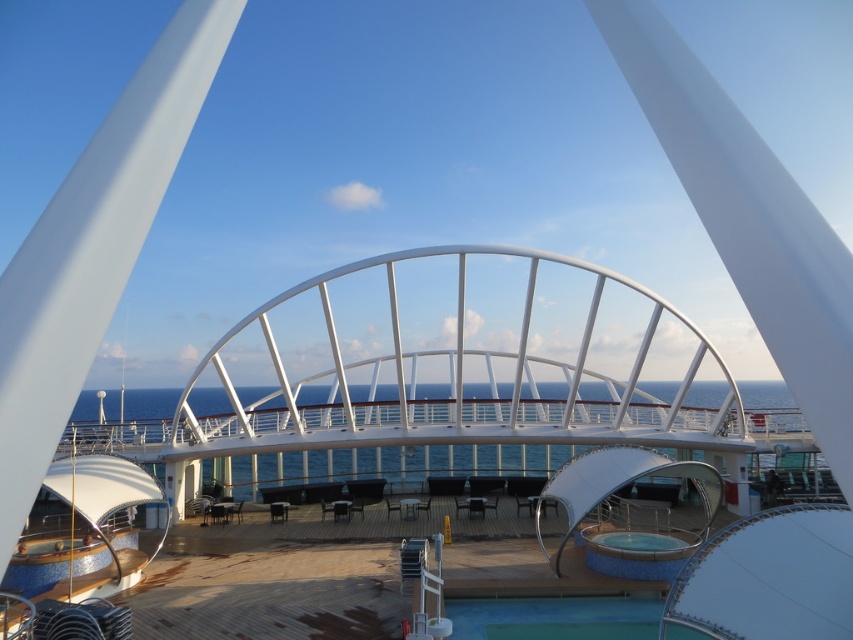
Who is higher up, green rubber pool at lower center or clear glass pool at center?

clear glass pool at center is above.

Which is more to the right, green rubber pool at lower center or clear glass pool at center?

From the viewer's perspective, clear glass pool at center appears more on the right side.

Describe the element at coordinates (554, 618) in the screenshot. I see `green rubber pool at lower center` at that location.

I want to click on green rubber pool at lower center, so click(x=554, y=618).